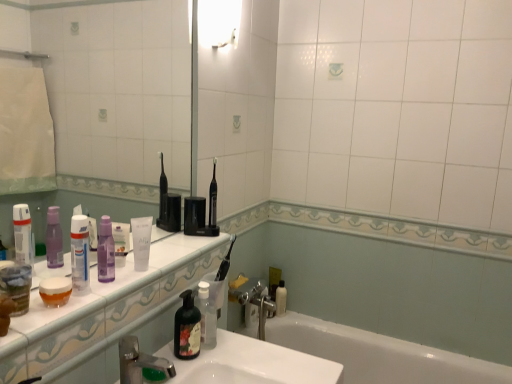
Identify the location of free space behind white matte tube at center, placed as the 2th toiletry when sorted from left to right. (169, 253).